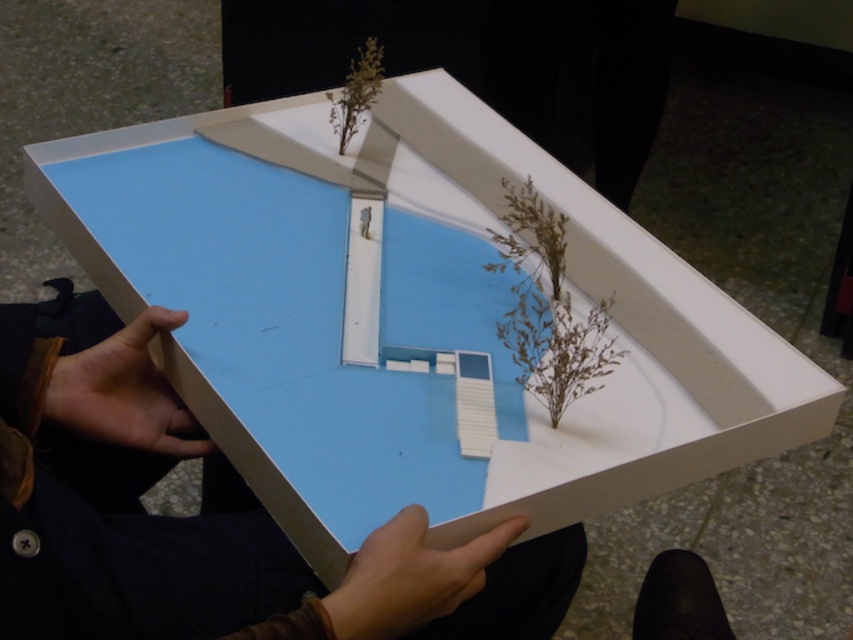
You are an architect reviewing a model house. You need to place a new decorative item at point (206,516). What is already there?

The matte white model house at center is located at point (206,516).

You are an architect reviewing a model house and a plant in a presentation case. You need to determine if the matte white model house at center can be moved closer to the brown textured plant at center without overlapping. Based on their widths, will they fit side by side within the case?

The matte white model house at center is wider than the brown textured plant at center. If the total width of both objects combined is less than the case width, they can fit side by side. However, since the case width isn